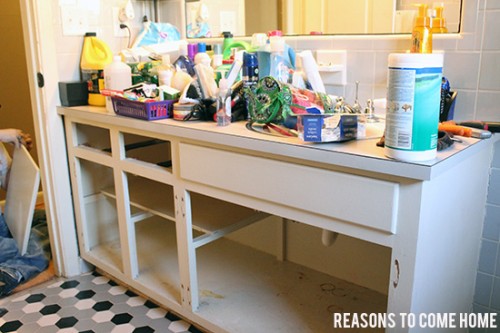
Can you see any where you'd install cabinet doors in the image? Point to them. Your answer should be formatted as a list of tuples, i.e. [(x1, y1), (x2, y2), ...], where each tuple contains the x and y coordinates of a point satisfying the conditions above.

[(106, 238), (161, 261), (251, 285)]